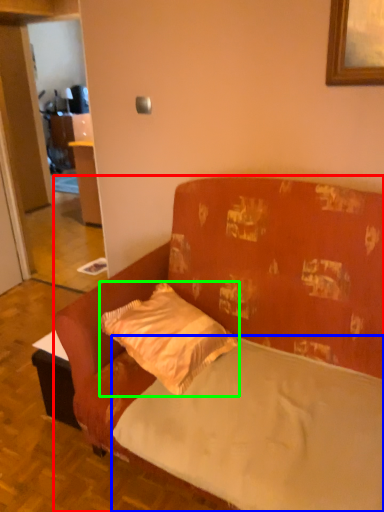
Question: Considering the real-world distances, which object is farthest from studio couch (highlighted by a red box)? mattress (highlighted by a blue box) or pillow (highlighted by a green box)?

Choices:
 (A) mattress
 (B) pillow

Answer: (B)